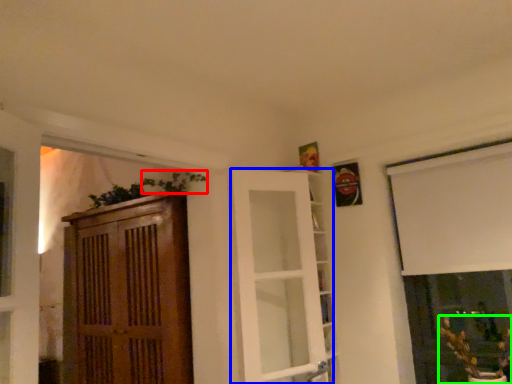
Question: Which object is the closest to the plant (highlighted by a red box)? Choose among these: door (highlighted by a blue box) or houseplant (highlighted by a green box).

Choices:
 (A) door
 (B) houseplant

Answer: (A)